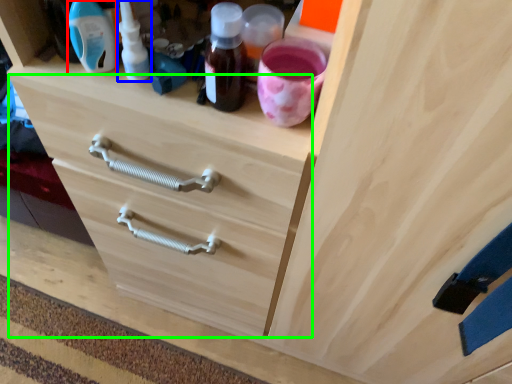
Question: Which object is the closest to the bottle (highlighted by a red box)? Choose among these: bottle (highlighted by a blue box) or drawer (highlighted by a green box).

Choices:
 (A) bottle
 (B) drawer

Answer: (A)